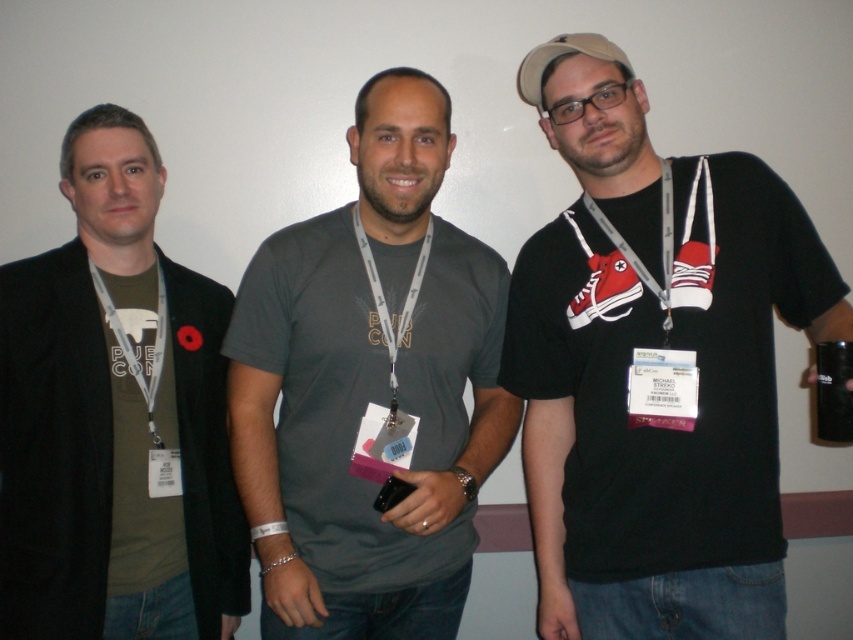
Does point (479, 280) come farther from viewer compared to point (386, 333)?

Yes, point (479, 280) is behind point (386, 333).

Is matte gray t-shirt at center further to camera compared to gray fabric lanyard at center?

No, matte gray t-shirt at center is in front of gray fabric lanyard at center.

The image size is (853, 640). Identify the location of matte gray t-shirt at center. (361, 419).

What do you see at coordinates (395, 211) in the screenshot? I see `matte gray shirt at center` at bounding box center [395, 211].

Can you confirm if matte gray shirt at center is smaller than gray fabric lanyard at center?

Indeed, matte gray shirt at center has a smaller size compared to gray fabric lanyard at center.

Is point (422, 228) positioned behind point (402, 326)?

Yes, point (422, 228) is farther from viewer.

Identify the location of matte gray shirt at center. (395, 211).

Consider the image. Does black matte t-shirt at center have a lesser height compared to green matte t-shirt at left?

No, black matte t-shirt at center is not shorter than green matte t-shirt at left.

Find the location of a particular element. black matte t-shirt at center is located at coordinates (663, 400).